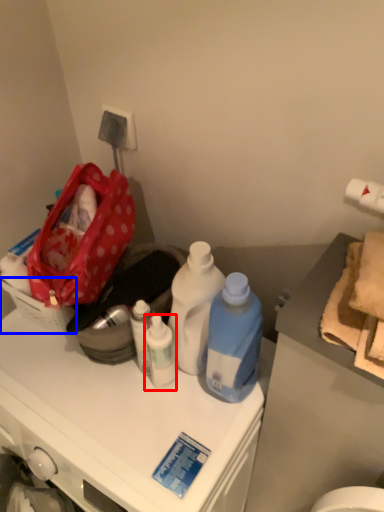
Question: Which point is closer to the camera, bottle (highlighted by a red box) or picnic basket (highlighted by a blue box)?

Choices:
 (A) bottle
 (B) picnic basket

Answer: (A)